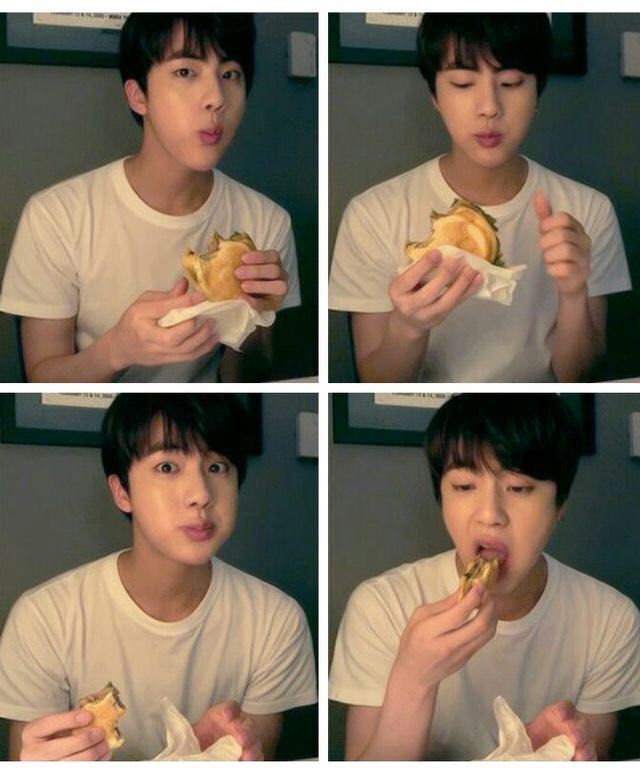
This screenshot has width=640, height=770. What are the coordinates of `pictures` in the screenshot? It's located at (342, 534).